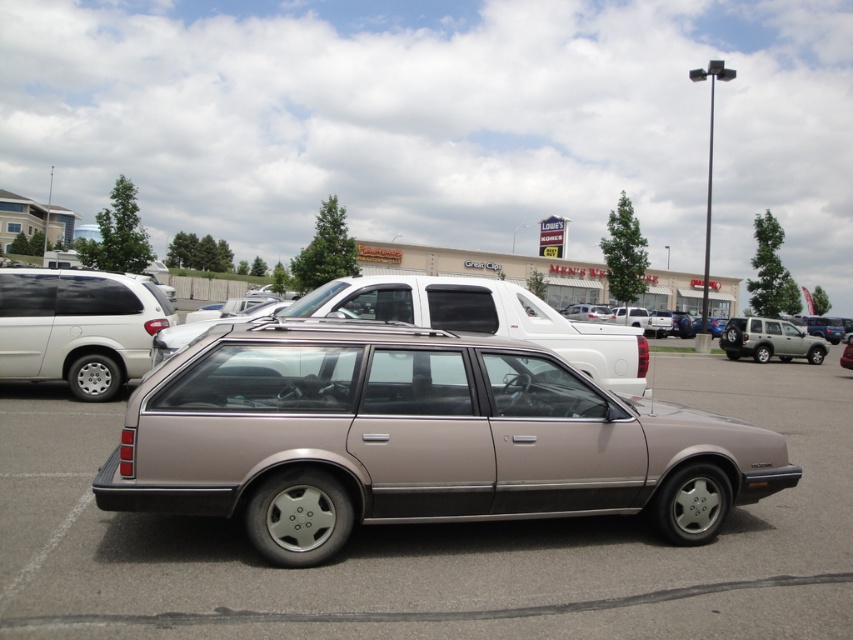
Can you confirm if matte black minivan at left is positioned to the right of metallic gold station wagon at center?

Incorrect, matte black minivan at left is not on the right side of metallic gold station wagon at center.

Identify the location of matte black minivan at left. This screenshot has width=853, height=640. (77, 326).

Find the location of `matte black minivan at left`. matte black minivan at left is located at coordinates (77, 326).

Is metallic gray station wagon at center bigger than metallic gold station wagon at center?

Actually, metallic gray station wagon at center might be smaller than metallic gold station wagon at center.

Is metallic gray station wagon at center taller than metallic gold station wagon at center?

Correct, metallic gray station wagon at center is much taller as metallic gold station wagon at center.

Does point (540, 596) lie in front of point (846, 356)?

Yes, it is.

Identify the location of metallic gray station wagon at center. pyautogui.click(x=434, y=545).

Which of these two, metallic gray station wagon at center or satin silver suv at right, stands taller?

satin silver suv at right

Where is `metallic gray station wagon at center`? metallic gray station wagon at center is located at coordinates (434, 545).

Locate an element on the screen. The width and height of the screenshot is (853, 640). metallic gray station wagon at center is located at coordinates (434, 545).